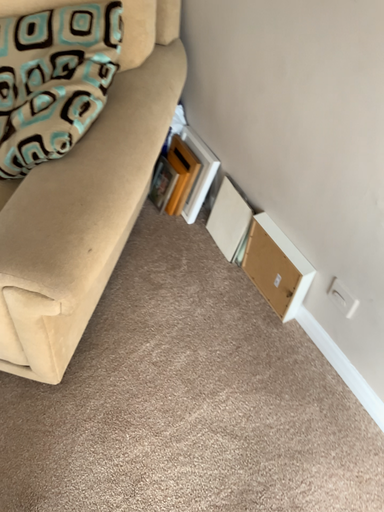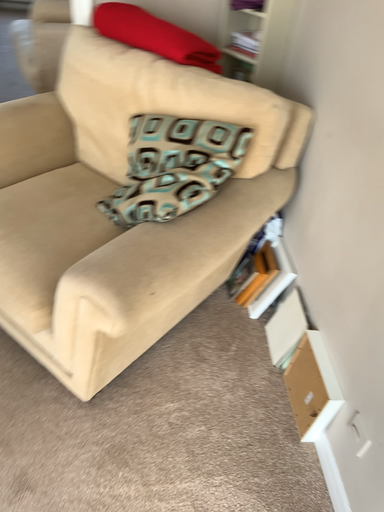
Question: Which way did the camera rotate in the video?

Choices:
 (A) rotated downward
 (B) rotated upward

Answer: (B)